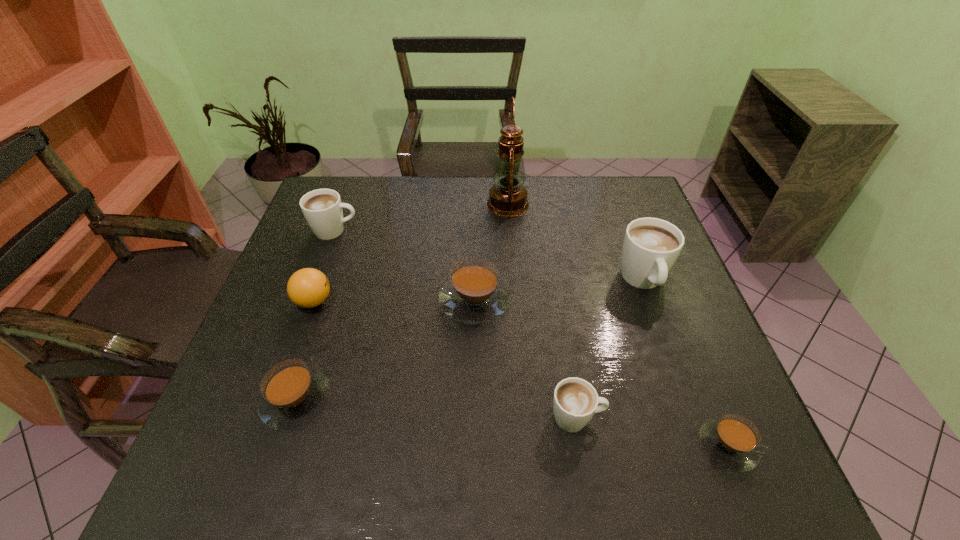
In order to click on free space located 0.140m on the back of the rightmost brown cappuccino in this screenshot , I will do `click(693, 360)`.

Locate an element on the screen. The height and width of the screenshot is (540, 960). oil lamp that is at the far edge is located at coordinates (508, 196).

The height and width of the screenshot is (540, 960). Identify the location of cappuccino located at the far edge. (323, 210).

This screenshot has width=960, height=540. What are the coordinates of `object at the near edge` in the screenshot? It's located at (732, 441).

Find the location of `ping-pong ball at the left edge`. ping-pong ball at the left edge is located at coordinates (308, 287).

The width and height of the screenshot is (960, 540). Find the location of `object that is at the far left corner`. object that is at the far left corner is located at coordinates (323, 210).

Locate an element on the screen. Image resolution: width=960 pixels, height=540 pixels. object that is at the near right corner is located at coordinates click(732, 441).

I want to click on vacant space at the far edge of the desktop, so click(x=385, y=180).

Locate an element on the screen. This screenshot has width=960, height=540. vacant space at the near edge of the desktop is located at coordinates (296, 458).

What are the coordinates of `vacant space at the left edge` in the screenshot? It's located at (223, 415).